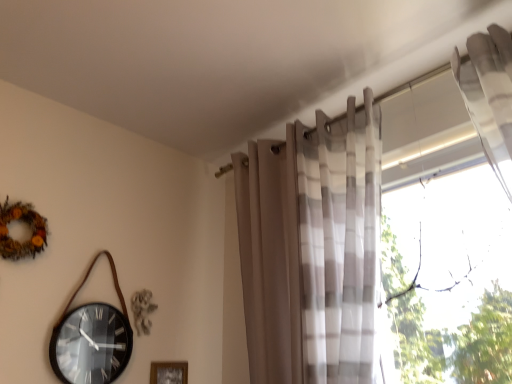
Question: From a real-world perspective, is transparent glass window at right above or below wooden frame at lower center?

Choices:
 (A) above
 (B) below

Answer: (A)

Question: Does point (473, 322) appear closer or farther from the camera than point (159, 372)?

Choices:
 (A) farther
 (B) closer

Answer: (B)

Question: Estimate the real-world distances between objects in this image. Which object is farther from the transparent glass window at right?

Choices:
 (A) wooden frame at lower center
 (B) translucent sheer curtain at upper right

Answer: (A)

Question: Based on their relative distances, which object is farther from the transparent glass window at right?

Choices:
 (A) translucent sheer curtain at upper right
 (B) wooden frame at lower center

Answer: (B)